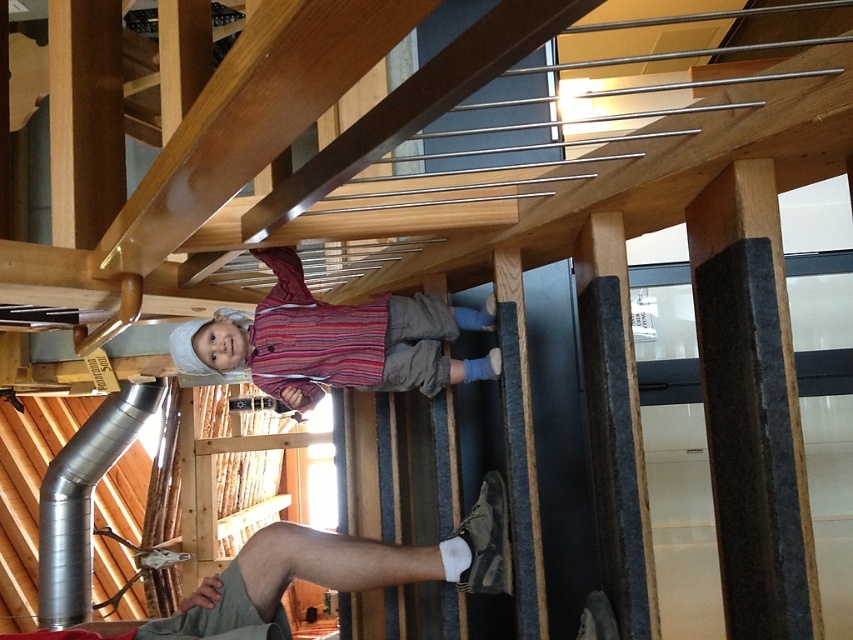
Between striped cotton shirt at center and light brown fabric leg at lower center, which one appears on the right side from the viewer's perspective?

striped cotton shirt at center is more to the right.

Can you confirm if striped cotton shirt at center is wider than light brown fabric leg at lower center?

No.

Does point (381, 314) come farther from viewer compared to point (410, 580)?

Yes, point (381, 314) is farther from viewer.

Where is `striped cotton shirt at center`? striped cotton shirt at center is located at coordinates (340, 340).

Does light brown fabric leg at lower center lie in front of silver metallic duct at lower left?

That is True.

Is light brown fabric leg at lower center to the left of silver metallic duct at lower left from the viewer's perspective?

Incorrect, light brown fabric leg at lower center is not on the left side of silver metallic duct at lower left.

Who is more forward, (497, 572) or (120, 408)?

Point (497, 572) is in front.

You are a GUI agent. You are given a task and a screenshot of the screen. Output one action in this format:
    pyautogui.click(x=<x>, y=<y>)
    Task: Click on the light brown fabric leg at lower center
    Image resolution: width=853 pixels, height=640 pixels.
    Given the screenshot: What is the action you would take?
    pyautogui.click(x=320, y=576)

Who is positioned more to the left, striped cotton shirt at center or silver metallic duct at lower left?

From the viewer's perspective, silver metallic duct at lower left appears more on the left side.

Does striped cotton shirt at center appear under silver metallic duct at lower left?

No.

Describe the element at coordinates (340, 340) in the screenshot. I see `striped cotton shirt at center` at that location.

The width and height of the screenshot is (853, 640). I want to click on striped cotton shirt at center, so click(x=340, y=340).